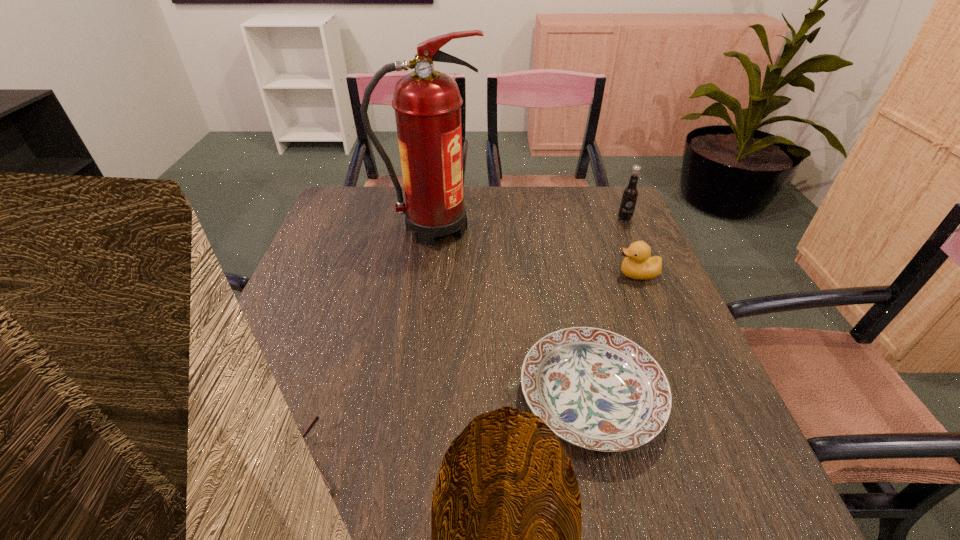
You are a GUI agent. You are given a task and a screenshot of the screen. Output one action in this format:
    pyautogui.click(x=<x>, y=<y>)
    Task: Click on the vacant space that is in between the fire extinguisher and the duckling
    The height and width of the screenshot is (540, 960).
    Given the screenshot: What is the action you would take?
    pyautogui.click(x=536, y=251)

The height and width of the screenshot is (540, 960). Find the location of `unoccupied area between the spectacles and the duckling`. unoccupied area between the spectacles and the duckling is located at coordinates (466, 369).

This screenshot has height=540, width=960. I want to click on free space that is in between the tallest object and the plate, so click(x=512, y=312).

Locate an element on the screen. The width and height of the screenshot is (960, 540). free space between the plate and the spectacles is located at coordinates (442, 430).

The width and height of the screenshot is (960, 540). I want to click on object that ranks as the fourth closest to the spectacles, so click(630, 194).

Locate an element on the screen. the closest object relative to the plate is located at coordinates (638, 265).

Find the location of a particular element. The width and height of the screenshot is (960, 540). vacant space that satisfies the following two spatial constraints: 1. on the label of the fourth shortest object; 2. on the front-facing side of the tallest object is located at coordinates (628, 228).

Find the location of a particular element. Image resolution: width=960 pixels, height=540 pixels. vacant space that satisfies the following two spatial constraints: 1. on the front-facing side of the fire extinguisher; 2. on the back side of the plate is located at coordinates (410, 396).

Find the location of a particular element. vacant region that satisfies the following two spatial constraints: 1. on the front-facing side of the tallest object; 2. on the back side of the plate is located at coordinates (410, 396).

Where is `vacant space that satisfies the following two spatial constraints: 1. on the face of the third tallest object; 2. on the front-facing side of the spectacles`? vacant space that satisfies the following two spatial constraints: 1. on the face of the third tallest object; 2. on the front-facing side of the spectacles is located at coordinates (716, 464).